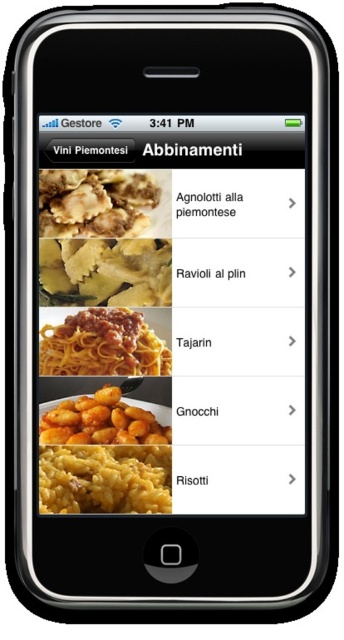
Between yellowish matte gnocchi at bottom and yellow matte pasta at center, which one is positioned lower?

yellowish matte gnocchi at bottom

You are a GUI agent. You are given a task and a screenshot of the screen. Output one action in this format:
    pyautogui.click(x=<x>, y=<y>)
    Task: Click on the yellowish matte gnocchi at bottom
    
    Given the screenshot: What is the action you would take?
    pyautogui.click(x=103, y=456)

The image size is (344, 640). I want to click on yellowish matte gnocchi at bottom, so 103,456.

Where is `yellowish matte gnocchi at bottom`? This screenshot has width=344, height=640. yellowish matte gnocchi at bottom is located at coordinates (103, 456).

Between yellow matte pasta at center and brown matte ravioli at upper left, which one appears on the left side from the viewer's perspective?

Positioned to the left is brown matte ravioli at upper left.

Does point (52, 241) come farther from viewer compared to point (95, 218)?

No, it is not.

Between point (133, 285) and point (109, 189), which one is positioned in front?

Point (109, 189) is more forward.

Identify the location of yellow matte pasta at center. (104, 272).

Does point (88, 424) come in front of point (79, 205)?

Yes, point (88, 424) is closer to viewer.

Consider the image. Does yellowish matte gnocchi at bottom have a larger size compared to brown matte ravioli at upper left?

Yes, yellowish matte gnocchi at bottom is bigger than brown matte ravioli at upper left.

This screenshot has height=640, width=344. Describe the element at coordinates (103, 456) in the screenshot. I see `yellowish matte gnocchi at bottom` at that location.

Locate an element on the screen. The width and height of the screenshot is (344, 640). yellowish matte gnocchi at bottom is located at coordinates (103, 456).